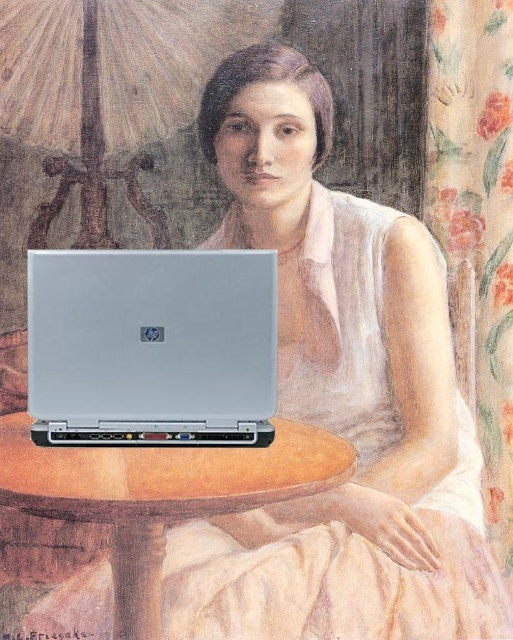
Question: Which object is farther from the camera taking this photo?

Choices:
 (A) matte silver laptop at center
 (B) wooden round table at center

Answer: (A)

Question: Which point is closer to the camera?

Choices:
 (A) silver metallic laptop at center
 (B) matte silver laptop at center
 (C) wooden round table at center

Answer: (C)

Question: Is matte silver laptop at center wider than silver metallic laptop at center?

Choices:
 (A) yes
 (B) no

Answer: (A)

Question: Is silver metallic laptop at center below wooden round table at center?

Choices:
 (A) yes
 (B) no

Answer: (B)

Question: Does silver metallic laptop at center come in front of wooden round table at center?

Choices:
 (A) yes
 (B) no

Answer: (B)

Question: Which of the following is the farthest from the observer?

Choices:
 (A) (117, 620)
 (B) (326, 500)

Answer: (B)